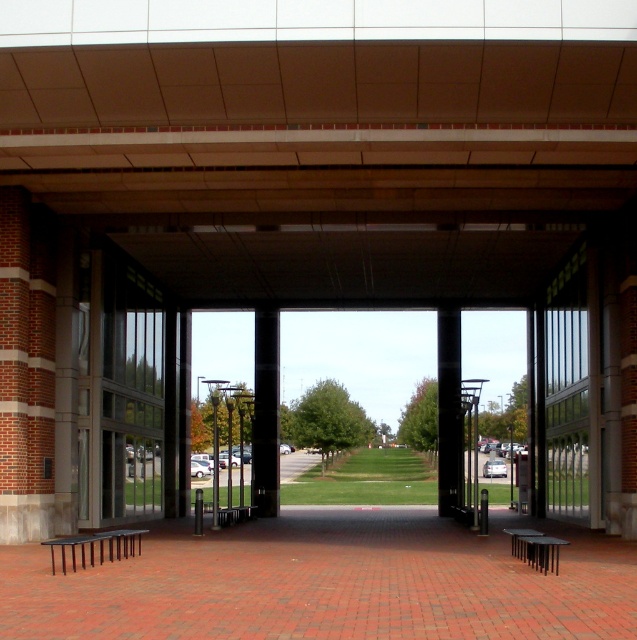
Is black glossy column at center wider than black smooth pillar at center?

Incorrect, black glossy column at center's width does not surpass black smooth pillar at center's.

Does black glossy column at center have a lesser height compared to black smooth pillar at center?

Correct, black glossy column at center is not as tall as black smooth pillar at center.

Is point (276, 324) positioned behind point (447, 316)?

Yes, point (276, 324) is farther from viewer.

Where is `black glossy column at center`? The width and height of the screenshot is (637, 640). black glossy column at center is located at coordinates (266, 412).